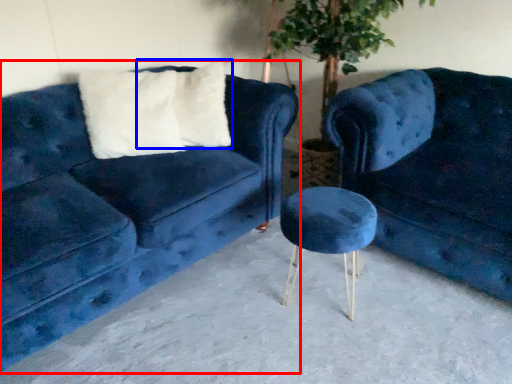
Question: Which point is further to the camera, studio couch (highlighted by a red box) or pillow (highlighted by a blue box)?

Choices:
 (A) studio couch
 (B) pillow

Answer: (B)